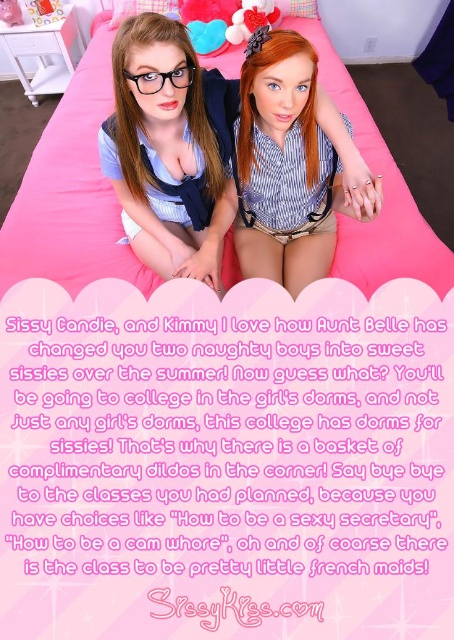
This screenshot has width=454, height=640. Describe the element at coordinates (166, 140) in the screenshot. I see `matte blue shirt at center` at that location.

Find the location of a particular element. The image size is (454, 640). matte blue shirt at center is located at coordinates (166, 140).

Where is `pink fabric bed at center`? pink fabric bed at center is located at coordinates (70, 195).

The height and width of the screenshot is (640, 454). Identify the location of pink fabric bed at center. (70, 195).

Who is more forward, (55, 230) or (159, 140)?

Point (159, 140) is more forward.

Where is `pink fabric bed at center`? The width and height of the screenshot is (454, 640). pink fabric bed at center is located at coordinates (70, 195).

Image resolution: width=454 pixels, height=640 pixels. Find the location of `pink fabric bed at center`. pink fabric bed at center is located at coordinates (70, 195).